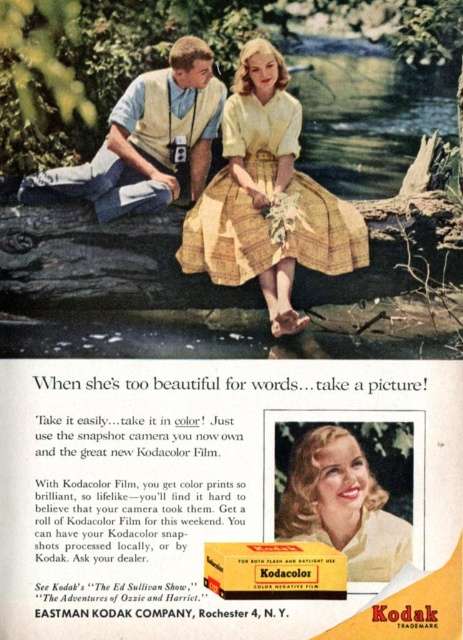
Question: Which of the following is the closest to the observer?

Choices:
 (A) (221, 192)
 (B) (112, 577)
 (C) (199, 61)
 (D) (300, 540)

Answer: (D)

Question: Is matte blue shirt at upper center thinner than matte yellow dress at center?

Choices:
 (A) no
 (B) yes

Answer: (A)

Question: Is yellow matte dress at center smaller than matte yellow dress at center?

Choices:
 (A) yes
 (B) no

Answer: (A)

Question: Which object appears closest to the camera in this image?

Choices:
 (A) matte blue shirt at upper center
 (B) yellow woven dress at center
 (C) matte yellow dress at center

Answer: (C)

Question: Which of these objects is positioned farthest from the matte yellow dress at center?

Choices:
 (A) yellow woven dress at center
 (B) matte blue shirt at upper center
 (C) yellow matte dress at center

Answer: (B)

Question: Can you confirm if yellow matte dress at center is bigger than yellow woven dress at center?

Choices:
 (A) no
 (B) yes

Answer: (A)